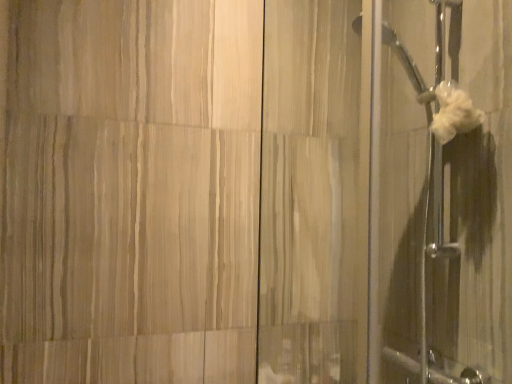
Question: Considering the relative sizes of white fluffy towel at upper right and white fabric at right in the image provided, is white fluffy towel at upper right smaller than white fabric at right?

Choices:
 (A) no
 (B) yes

Answer: (B)

Question: Is white fluffy towel at upper right bigger than white fabric at right?

Choices:
 (A) yes
 (B) no

Answer: (B)

Question: Considering the relative sizes of white fluffy towel at upper right and white fabric at right in the image provided, is white fluffy towel at upper right shorter than white fabric at right?

Choices:
 (A) no
 (B) yes

Answer: (B)

Question: From a real-world perspective, is white fluffy towel at upper right over white fabric at right?

Choices:
 (A) no
 (B) yes

Answer: (B)

Question: From the image's perspective, would you say white fluffy towel at upper right is positioned over white fabric at right?

Choices:
 (A) no
 (B) yes

Answer: (B)

Question: Is the position of white fluffy towel at upper right more distant than that of white fabric at right?

Choices:
 (A) yes
 (B) no

Answer: (A)

Question: Could you tell me if white fabric at right is facing white fluffy towel at upper right?

Choices:
 (A) yes
 (B) no

Answer: (A)

Question: From the image's perspective, is white fabric at right under white fluffy towel at upper right?

Choices:
 (A) no
 (B) yes

Answer: (B)

Question: Considering the relative sizes of white fabric at right and white fluffy towel at upper right in the image provided, is white fabric at right smaller than white fluffy towel at upper right?

Choices:
 (A) no
 (B) yes

Answer: (A)

Question: From a real-world perspective, is white fabric at right under white fluffy towel at upper right?

Choices:
 (A) no
 (B) yes

Answer: (B)

Question: Can you confirm if white fabric at right is thinner than white fluffy towel at upper right?

Choices:
 (A) no
 (B) yes

Answer: (A)

Question: Is white fabric at right behind white fluffy towel at upper right?

Choices:
 (A) no
 (B) yes

Answer: (A)

Question: Is white fabric at right bigger or smaller than white fluffy towel at upper right?

Choices:
 (A) big
 (B) small

Answer: (A)